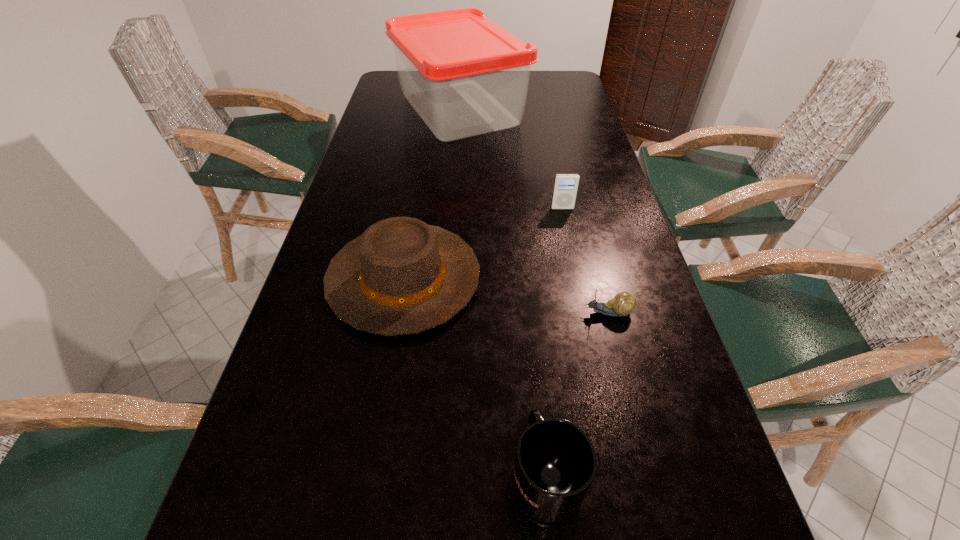
Where is `object that is at the far left corner`? object that is at the far left corner is located at coordinates (464, 75).

The image size is (960, 540). Identify the location of vacant space at the left edge of the desktop. (413, 136).

At what (x,y) coordinates should I click in order to perform the action: click on vacant position at the right edge of the desktop. Please return your answer as a coordinate pair (x, y). Looking at the image, I should click on (591, 316).

Identify the location of free space at the far left corner of the desktop. (389, 85).

Where is `vacant area at the far right corner of the desktop`? vacant area at the far right corner of the desktop is located at coordinates (556, 70).

Find the location of a particular element. The height and width of the screenshot is (540, 960). free space between the iPod and the escargot is located at coordinates (585, 260).

This screenshot has width=960, height=540. In order to click on vacant space in between the nearest object and the escargot in this screenshot , I will do `click(577, 394)`.

The height and width of the screenshot is (540, 960). Find the location of `vacant area that lies between the nearest object and the cowboy hat`. vacant area that lies between the nearest object and the cowboy hat is located at coordinates (475, 377).

Where is `vacant space that is in between the second farthest object and the shortest object`? vacant space that is in between the second farthest object and the shortest object is located at coordinates (585, 260).

This screenshot has width=960, height=540. I want to click on free spot between the cowboy hat and the iPod, so click(483, 244).